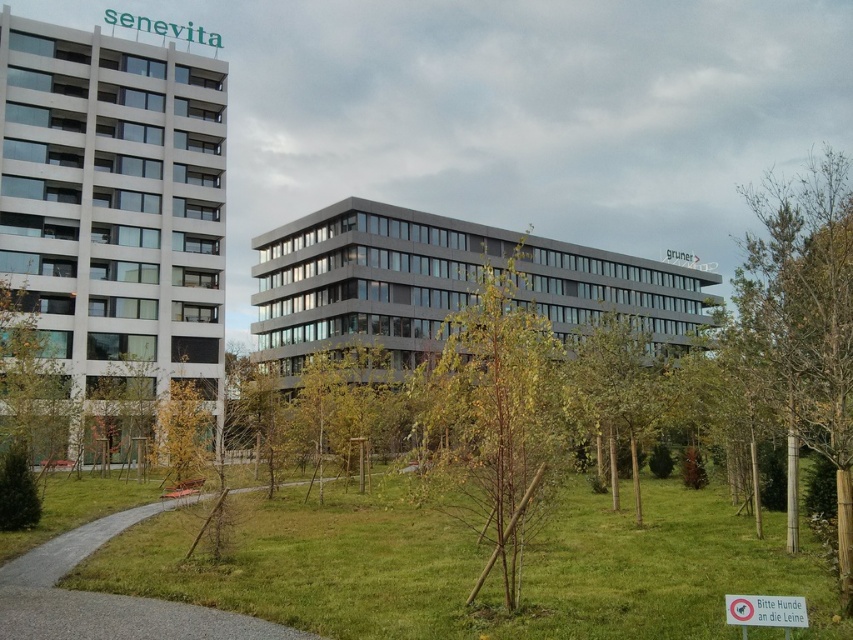
Who is higher up, brown wood tree at center or green leafy tree at center?

brown wood tree at center is above.

Based on the photo, measure the distance from brown wood tree at center to green leafy tree at center.

A distance of 14.11 meters exists between brown wood tree at center and green leafy tree at center.

Does point (456, 394) come closer to viewer compared to point (613, 323)?

Yes, it is in front of point (613, 323).

Identify the location of brown wood tree at center. This screenshot has height=640, width=853. (492, 419).

Is green grassy at lower left further to camera compared to green leafy tree at center?

No.

Locate an element on the screen. The width and height of the screenshot is (853, 640). green grassy at lower left is located at coordinates (474, 566).

Does green grassy at lower left have a greater height compared to brown wood tree at center?

Incorrect, green grassy at lower left's height is not larger of brown wood tree at center's.

Find the location of a particular element. This screenshot has width=853, height=640. green grassy at lower left is located at coordinates (474, 566).